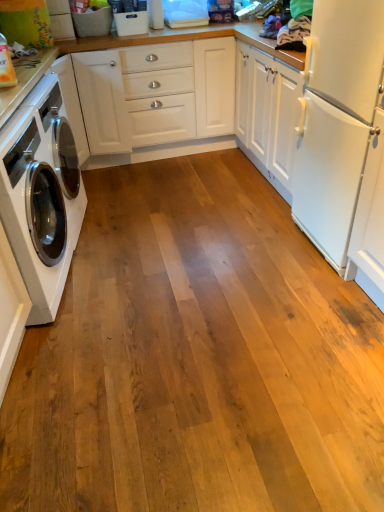
Question: Should I look upward or downward to see white glossy washing machine at left?

Choices:
 (A) up
 (B) down

Answer: (A)